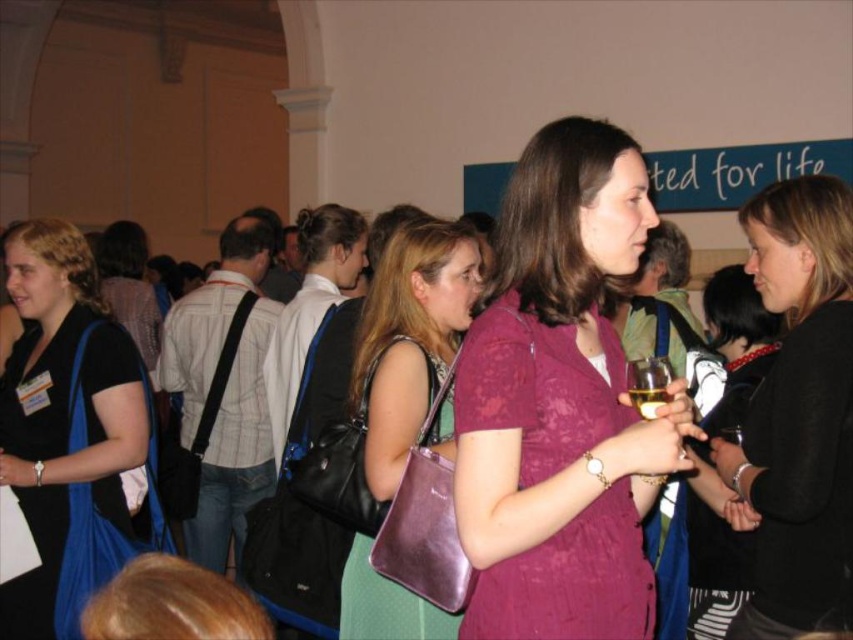
Question: Which object appears farthest from the camera in this image?

Choices:
 (A) shiny purple purse at center
 (B) matte purple dress at center
 (C) black matte dress at center
 (D) black leather purse at center

Answer: (D)

Question: Which of the following is the closest to the observer?

Choices:
 (A) (701, 509)
 (B) (566, 428)

Answer: (B)

Question: Among these objects, which one is farthest from the camera?

Choices:
 (A) black leather purse at center
 (B) translucent glass at center
 (C) shiny purple purse at center
 (D) black matte dress at center

Answer: (A)

Question: Can you confirm if black matte dress at center is wider than translucent glass at center?

Choices:
 (A) no
 (B) yes

Answer: (B)

Question: Does matte purple dress at center have a lesser width compared to black leather purse at center?

Choices:
 (A) yes
 (B) no

Answer: (B)

Question: Does black fabric purse at left come behind black matte dress at center?

Choices:
 (A) no
 (B) yes

Answer: (B)